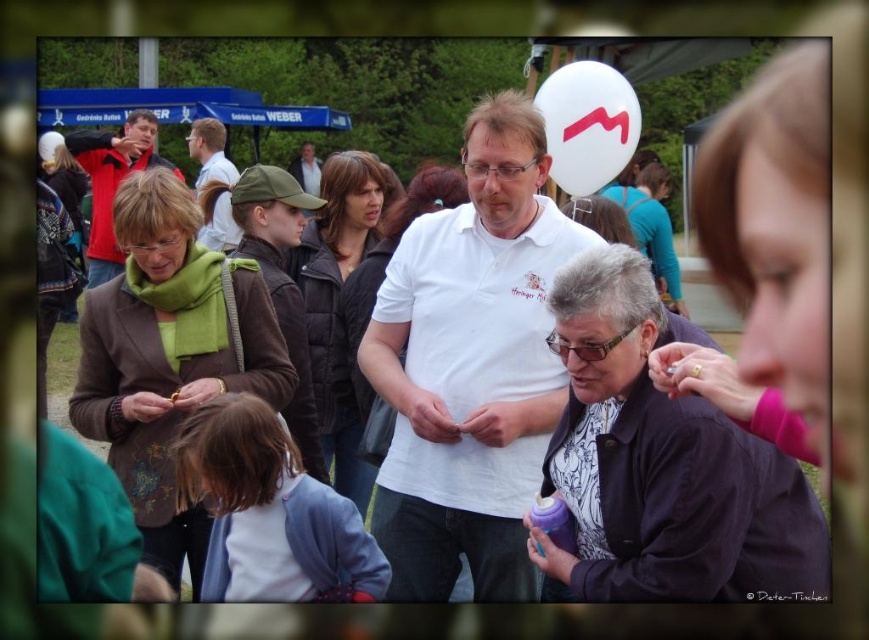
You are organizing a photo shoot and need to arrange the subjects so that the brown quilted jacket at center and the matte black jacket at center are visible in the frame. Given their sizes, which jacket should be placed closer to the camera to ensure both are fully visible?

The brown quilted jacket at center occupies less space than the matte black jacket at center, so placing the brown quilted jacket at center closer to the camera will help ensure both jackets are fully visible in the frame.

You are a photographer at this event and want to take a photo that includes both the white matte shirt at center and the matte brown jacket at upper left. Which object should you focus on first to ensure both are in sharp focus?

You should focus on the white matte shirt at center first since it is closer to the viewer than the matte brown jacket at upper left, ensuring both will be in focus when using a proper aperture setting.

Based on the photo, you are organizing a photo shoot and need to place a 1.2 meter tall tripod between the matte green scarf at left and the brown quilted jacket at center. Can the tripod fit vertically between them without exceeding their combined height?

The matte green scarf at left is shorter than the brown quilted jacket at center. Since the combined height of both objects would be less than 1.2 meters, the tripod cannot fit vertically between them.